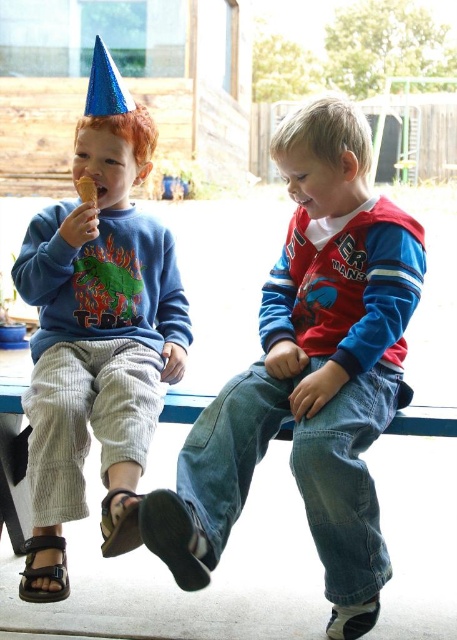
Question: Is denim jeans at center to the left of brown leather sandal at lower left from the viewer's perspective?

Choices:
 (A) yes
 (B) no

Answer: (B)

Question: Can you confirm if denim jeans at center is thinner than black leather sandal at lower left?

Choices:
 (A) no
 (B) yes

Answer: (A)

Question: Can you confirm if matte blue party hat at left is wider than black leather sandal at lower left?

Choices:
 (A) no
 (B) yes

Answer: (B)

Question: Which is farther from the denim jeans at center?

Choices:
 (A) brown leather sandal at lower left
 (B) black leather sandal at lower left

Answer: (B)

Question: Among these points, which one is farthest from the camera?

Choices:
 (A) (116, 547)
 (B) (48, 589)
 (C) (21, 284)

Answer: (C)

Question: Which point is closer to the camera?

Choices:
 (A) matte blue party hat at left
 (B) black leather sandal at lower left
 (C) denim jeans at center

Answer: (C)